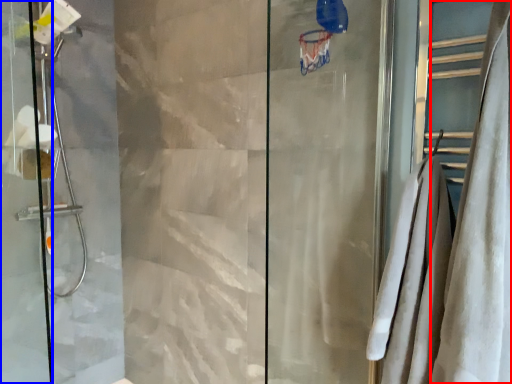
Question: Which object appears closest to the camera in this image, shower curtain (highlighted by a red box) or screen door (highlighted by a blue box)?

Choices:
 (A) shower curtain
 (B) screen door

Answer: (A)